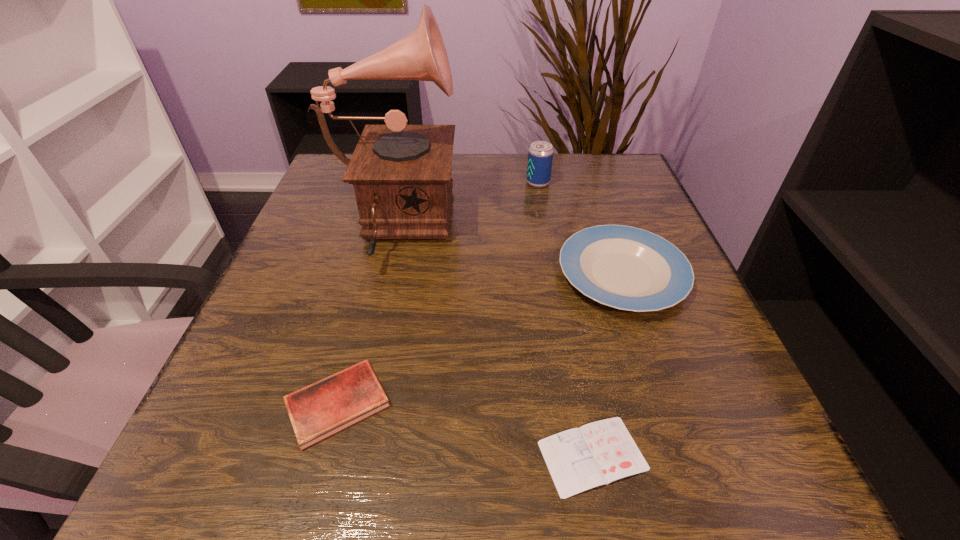
Locate an element on the screen. vacant space that satisfies the following two spatial constraints: 1. on the horn of the shorter diary; 2. on the right side of the tallest object is located at coordinates (337, 456).

Find the location of a particular element. vacant position in the image that satisfies the following two spatial constraints: 1. on the horn of the record player; 2. on the left side of the shorter diary is located at coordinates (337, 456).

What are the coordinates of `vacant space that satisfies the following two spatial constraints: 1. on the horn of the shortest object; 2. on the right side of the record player` in the screenshot? It's located at tap(337, 456).